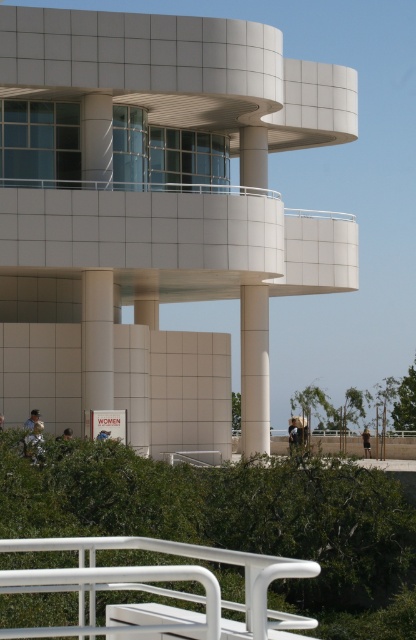
You are a maintenance worker tasked with measuring the height of the white tile building at center and the white matte rail at lower center. Based on the scene, which one is taller?

The white tile building at center is taller than the white matte rail at lower center.

You are standing at the point marked by the coordinates point (153, 202) in the image. What is the closest object to you?

The point (153, 202) marks the white tile building at center, so the closest object to you is the white tile building at center.